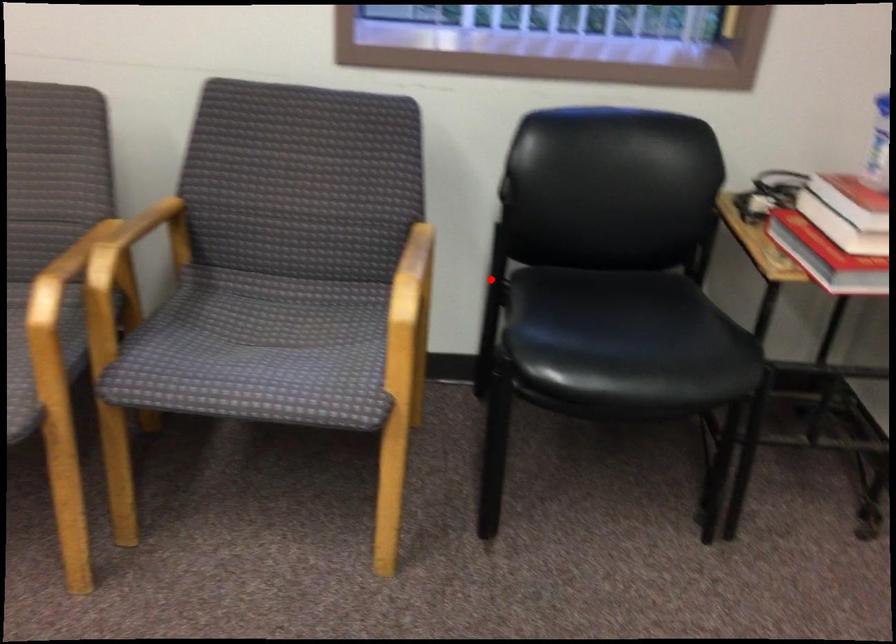
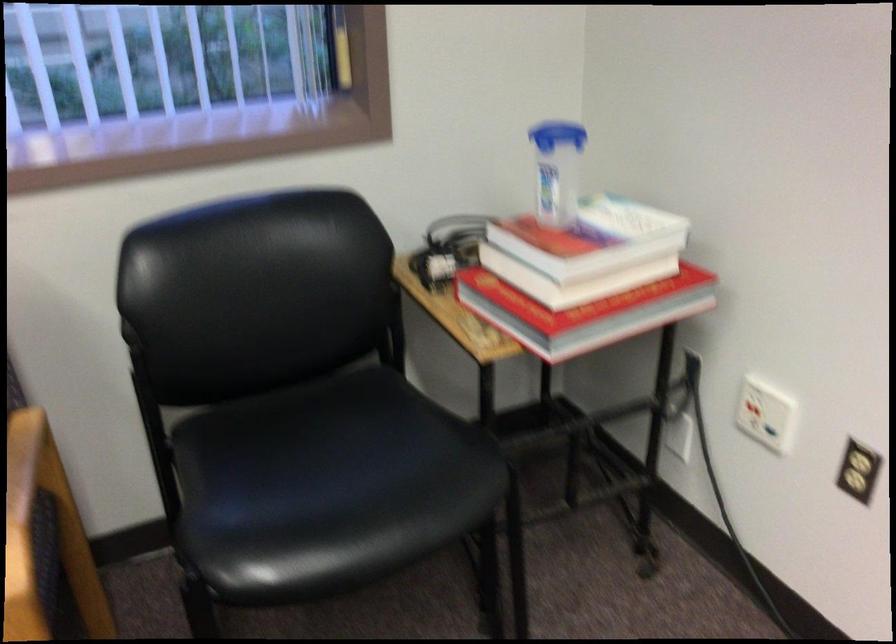
Question: I am providing you with two images of the same scene from different viewpoints. A red point is marked on the first image. At the location where the point appears in image 1, is it still visible in image 2?

Choices:
 (A) Yes
 (B) No

Answer: (A)